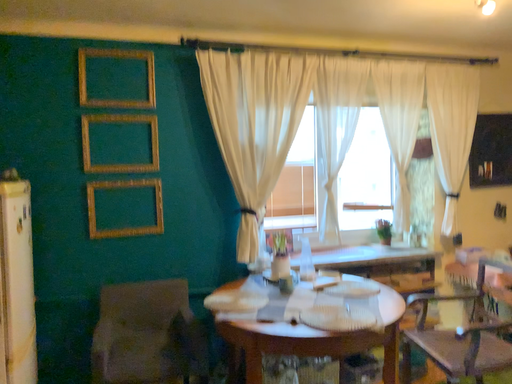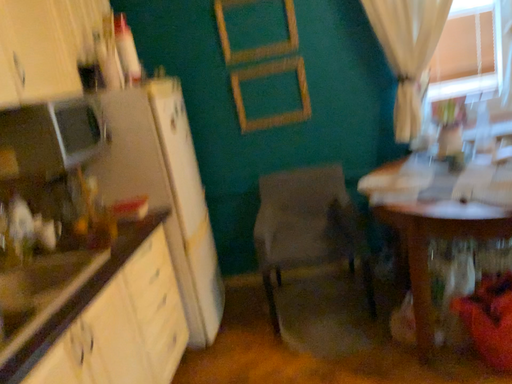
Question: How did the camera likely rotate when shooting the video?

Choices:
 (A) rotated upward
 (B) rotated downward

Answer: (B)